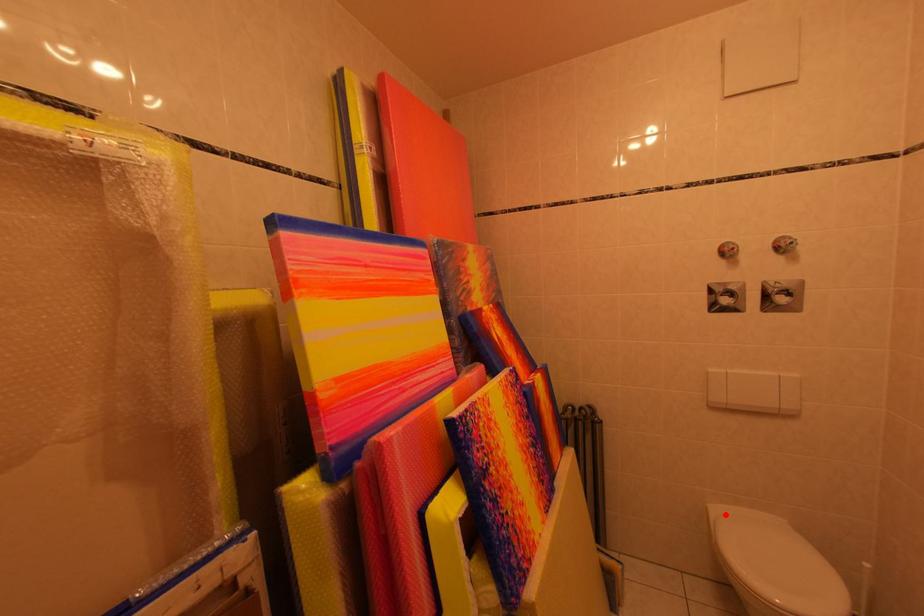
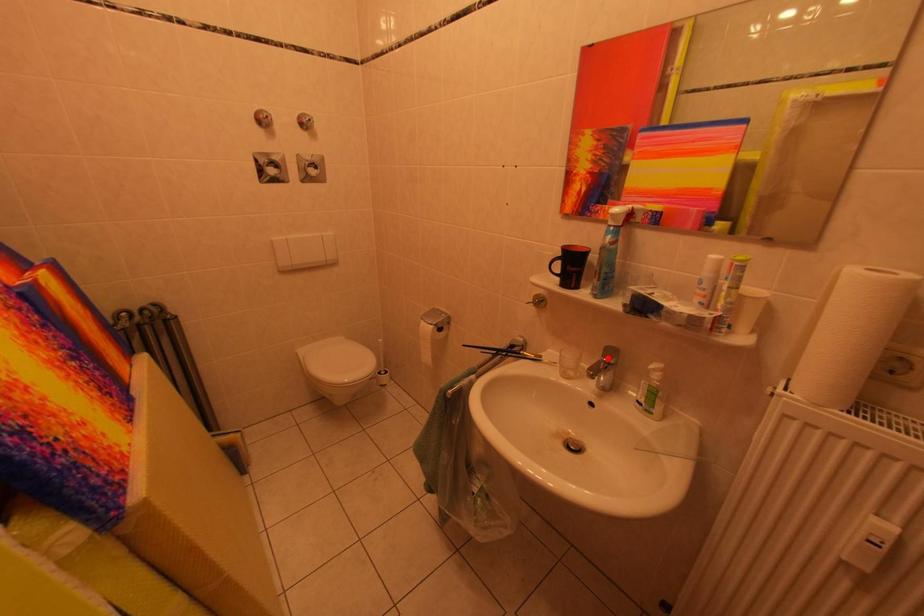
I am providing you with two images of the same scene from different viewpoints. A red point is marked on the first image and another point is marked on the second image. Is the red point in image1 aligned with the point shown in image2?

No